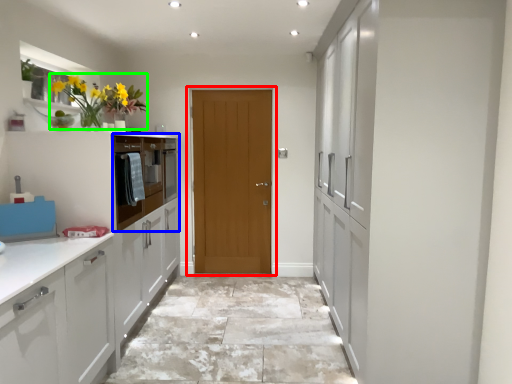
Question: Which is nearer to the door (highlighted by a red box)? oven (highlighted by a blue box) or floral arrangement (highlighted by a green box).

Choices:
 (A) oven
 (B) floral arrangement

Answer: (A)